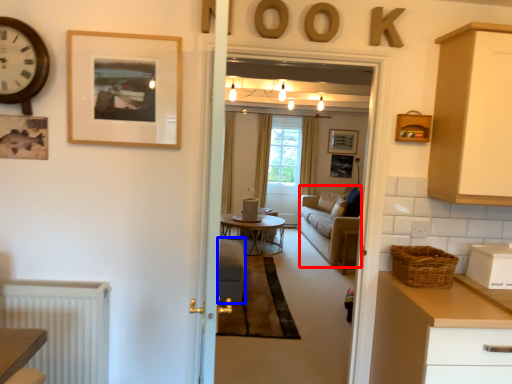
Question: Which object is further to the camera taking this photo, couch (highlighted by a red box) or armchair (highlighted by a blue box)?

Choices:
 (A) couch
 (B) armchair

Answer: (A)